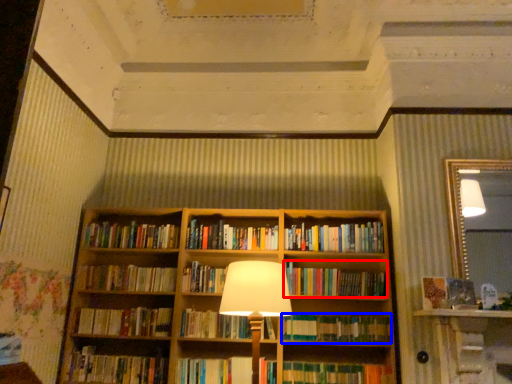
Question: Which object is closer to the camera taking this photo, book (highlighted by a red box) or book (highlighted by a blue box)?

Choices:
 (A) book
 (B) book

Answer: (B)